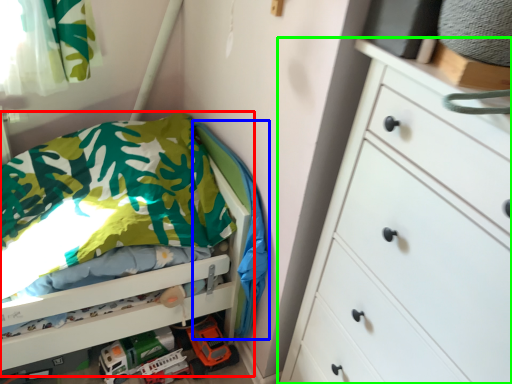
Question: Estimate the real-world distances between objects in this image. Which object is farther from bed (highlighted by a red box), blanket (highlighted by a blue box) or chest of drawers (highlighted by a green box)?

Choices:
 (A) blanket
 (B) chest of drawers

Answer: (B)